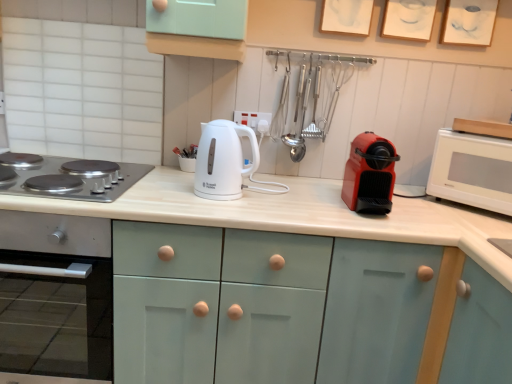
This screenshot has width=512, height=384. I want to click on free space to the left of red matte coffee machine at right, the 1th kitchen appliance from the right, so click(x=309, y=205).